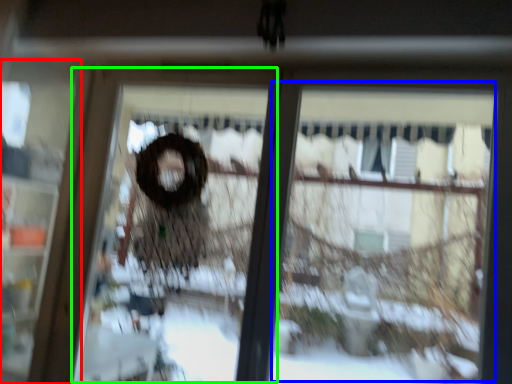
Question: Based on their relative distances, which object is farther from screen door (highlighted by a red box)? Choose from shop window (highlighted by a blue box) and screen door (highlighted by a green box).

Choices:
 (A) shop window
 (B) screen door

Answer: (A)